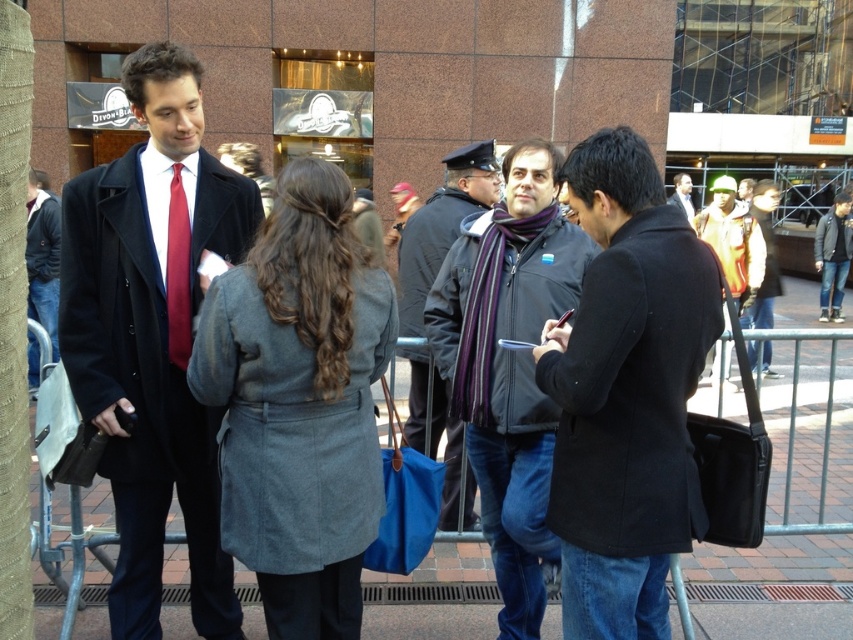
Does dark gray jacket at center have a larger size compared to camouflage jacket at right?

No.

Does dark gray jacket at center appear on the left side of camouflage jacket at right?

Yes, dark gray jacket at center is to the left of camouflage jacket at right.

Measure the distance between point (477, 372) and camera.

A distance of 9.88 feet exists between point (477, 372) and camera.

In order to click on dark gray jacket at center in this screenshot , I will do `click(509, 365)`.

Does dark gray jacket at center have a lesser width compared to yellow jacket at center?

Incorrect, dark gray jacket at center's width is not less than yellow jacket at center's.

Does dark gray jacket at center have a smaller size compared to yellow jacket at center?

No, dark gray jacket at center is not smaller than yellow jacket at center.

Image resolution: width=853 pixels, height=640 pixels. Describe the element at coordinates (509, 365) in the screenshot. I see `dark gray jacket at center` at that location.

At what (x,y) coordinates should I click in order to perform the action: click on dark gray jacket at center. Please return your answer as a coordinate pair (x, y). This screenshot has width=853, height=640. Looking at the image, I should click on (509, 365).

Measure the distance between camouflage jacket at right and camera.

The distance of camouflage jacket at right from camera is 7.17 meters.

What do you see at coordinates (733, 241) in the screenshot? The height and width of the screenshot is (640, 853). I see `camouflage jacket at right` at bounding box center [733, 241].

Does point (724, 252) come closer to viewer compared to point (762, 304)?

Yes, it is.

Identify the location of camouflage jacket at right. (733, 241).